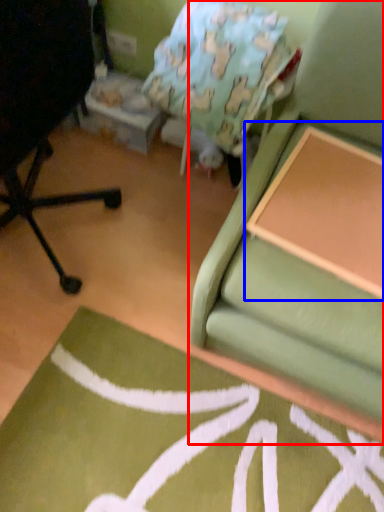
Question: Which object is closer to the camera taking this photo, studio couch (highlighted by a red box) or table (highlighted by a blue box)?

Choices:
 (A) studio couch
 (B) table

Answer: (A)